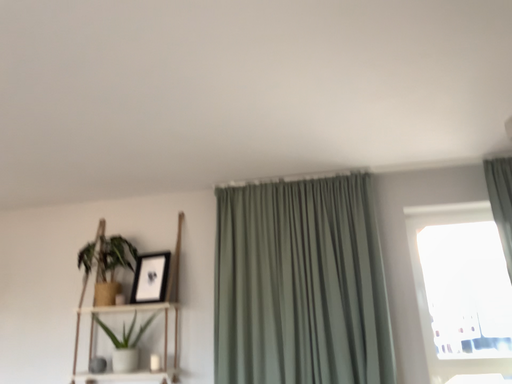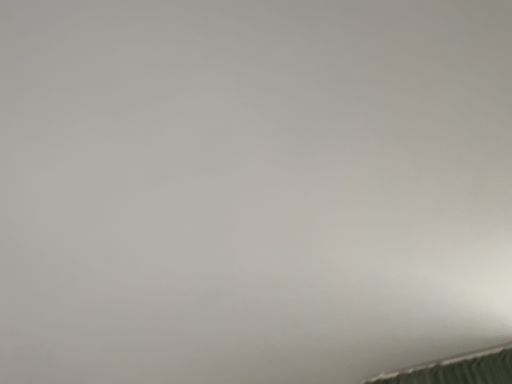
Question: Which way did the camera rotate in the video?

Choices:
 (A) rotated left
 (B) rotated right

Answer: (A)